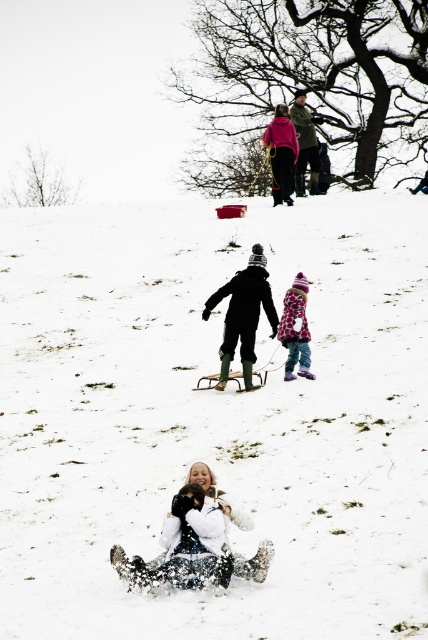
You are a parent trying to find a safe spot for your child to play in the snowy area. The white fluffy snow at center and the pink fleece jacket at upper center are visible. Which area would you choose for safer sliding, and why?

The white fluffy snow at center is safer for sliding because its width is larger than the pink fleece jacket at upper center, providing a more stable and spacious area.

You are standing at the point marked as point (282, 154) in the image. Looking around, you see a pink fleece jacket at upper center and a black sled at lower right. Which object is closer to your current position?

The pink fleece jacket at upper center is closer to your current position because the point (282, 154) is on the pink fleece jacket at upper center.

You are a photographer trying to capture a group photo of the two children in the snowy scene. The children are wearing a pink fleece jacket at upper center and a dark green jacket at upper center. Since you want to ensure both are in focus, you need to know which jacket is wider to adjust your camera settings. Which one has a larger width?

The dark green jacket at upper center has a greater width compared to the pink fleece jacket at upper center, so you should adjust your camera settings to account for its larger size.